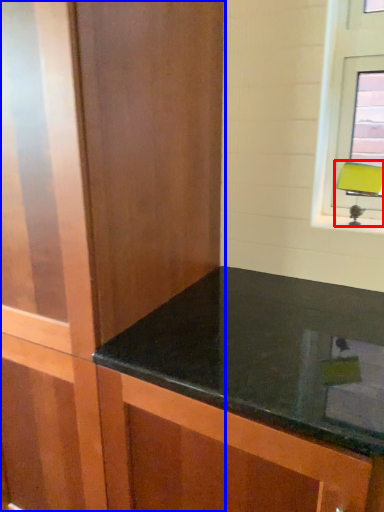
Question: Which point is further to the camera, table lamp (highlighted by a red box) or dresser (highlighted by a blue box)?

Choices:
 (A) table lamp
 (B) dresser

Answer: (A)